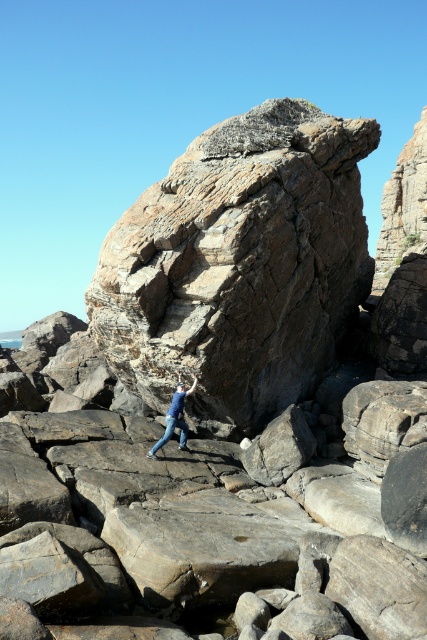
Question: Which of the following is the closest to the observer?

Choices:
 (A) (312, 358)
 (B) (178, 400)

Answer: (B)

Question: Where is rusty stone boulder at center located in relation to blue denim jeans at center in the image?

Choices:
 (A) above
 (B) below

Answer: (A)

Question: From the image, what is the correct spatial relationship of rusty stone boulder at center in relation to blue denim jeans at center?

Choices:
 (A) right
 (B) left

Answer: (B)

Question: Considering the relative positions of rusty stone boulder at center and blue denim jeans at center in the image provided, where is rusty stone boulder at center located with respect to blue denim jeans at center?

Choices:
 (A) right
 (B) left

Answer: (B)

Question: Among these points, which one is nearest to the camera?

Choices:
 (A) (152, 454)
 (B) (228, 296)

Answer: (A)

Question: Which point is farther to the camera?

Choices:
 (A) blue denim jeans at center
 (B) rusty stone boulder at center

Answer: (B)